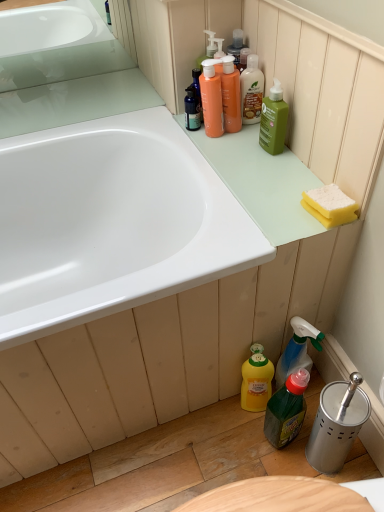
The image size is (384, 512). What do you see at coordinates (251, 91) in the screenshot? I see `translucent plastic bottle at upper center, positioned as the 5th cleaning product in bottom-to-top order` at bounding box center [251, 91].

You are a GUI agent. You are given a task and a screenshot of the screen. Output one action in this format:
    pyautogui.click(x=<x>, y=<y>)
    Task: Click on the translucent plastic bottle at upper center, which appears as the first cleaning product when viewed from the top
    The width and height of the screenshot is (384, 512).
    Given the screenshot: What is the action you would take?
    pyautogui.click(x=251, y=91)

The width and height of the screenshot is (384, 512). What do you see at coordinates (297, 350) in the screenshot? I see `translucent plastic spray bottle at lower right, which is the fourth cleaning product in top-to-bottom order` at bounding box center [297, 350].

What is the approximate width of yellow sponge at upper right?

It is 3.66 inches.

What do you see at coordinates (330, 202) in the screenshot?
I see `yellow sponge at upper right` at bounding box center [330, 202].

This screenshot has width=384, height=512. What do you see at coordinates (273, 120) in the screenshot?
I see `green matte bottle at upper right, which ranks as the third cleaning product in bottom-to-top order` at bounding box center [273, 120].

Where is `yellow matte bottle at lower center, positioned as the 1th cleaning product in bottom-to-top order`? This screenshot has height=512, width=384. yellow matte bottle at lower center, positioned as the 1th cleaning product in bottom-to-top order is located at coordinates (256, 380).

Where is `translucent plastic bottle at upper center, which appears as the first cleaning product when viewed from the top`? translucent plastic bottle at upper center, which appears as the first cleaning product when viewed from the top is located at coordinates (251, 91).

Consider the image. Is matte orange pump bottles at upper center, the fourth cleaning product positioned from the bottom, spatially inside green matte bottle at upper right, which appears as the 3th cleaning product when viewed from the top, or outside of it?

matte orange pump bottles at upper center, the fourth cleaning product positioned from the bottom, is not enclosed by green matte bottle at upper right, which appears as the 3th cleaning product when viewed from the top.

At what (x,y) coordinates should I click in order to perform the action: click on cleaning product that is the 2nd one when counting backward from the green matte bottle at upper right, which appears as the 3th cleaning product when viewed from the top. Please return your answer as a coordinate pair (x, y). The height and width of the screenshot is (512, 384). Looking at the image, I should click on (211, 99).

Is matte orange pump bottles at upper center, which is the second cleaning product from top to bottom, aimed at green matte bottle at upper right, which ranks as the third cleaning product in bottom-to-top order?

No, matte orange pump bottles at upper center, which is the second cleaning product from top to bottom, does not turn towards green matte bottle at upper right, which ranks as the third cleaning product in bottom-to-top order.

Which of these two, translucent green bottle at lower center or yellow sponge at upper right, stands taller?

translucent green bottle at lower center.

Could you tell me if translucent green bottle at lower center is turned towards yellow sponge at upper right?

No.

Can you confirm if translucent green bottle at lower center is thinner than yellow sponge at upper right?

No.

Is translucent green bottle at lower center touching yellow sponge at upper right?

There is a gap between translucent green bottle at lower center and yellow sponge at upper right.

Are translucent plastic spray bottle at lower right, which is the fourth cleaning product in top-to-bottom order, and yellow sponge at upper right far apart?

No, there isn't a large distance between translucent plastic spray bottle at lower right, which is the fourth cleaning product in top-to-bottom order, and yellow sponge at upper right.

From the image's perspective, between translucent plastic spray bottle at lower right, which is the fourth cleaning product in top-to-bottom order, and yellow sponge at upper right, which one is located above?

yellow sponge at upper right, from the image's perspective.

Which point is more distant from viewer, (294, 328) or (337, 207)?

Positioned behind is point (294, 328).

Can you confirm if translucent plastic spray bottle at lower right, which is counted as the 2th cleaning product, starting from the bottom, is smaller than yellow sponge at upper right?

No, translucent plastic spray bottle at lower right, which is counted as the 2th cleaning product, starting from the bottom, is not smaller than yellow sponge at upper right.

How different are the orientations of translucent plastic bottle at upper center, positioned as the 5th cleaning product in bottom-to-top order, and yellow sponge at upper right in degrees?

There is a 2.39-degree angle between the facing directions of translucent plastic bottle at upper center, positioned as the 5th cleaning product in bottom-to-top order, and yellow sponge at upper right.

Can you confirm if translucent plastic bottle at upper center, positioned as the 5th cleaning product in bottom-to-top order, is taller than yellow sponge at upper right?

Yes.

Which is more to the left, translucent plastic bottle at upper center, positioned as the 5th cleaning product in bottom-to-top order, or yellow sponge at upper right?

translucent plastic bottle at upper center, positioned as the 5th cleaning product in bottom-to-top order, is more to the left.

Is translucent plastic bottle at upper center, positioned as the 5th cleaning product in bottom-to-top order, positioned with its back to yellow sponge at upper right?

No.

This screenshot has height=512, width=384. In order to click on cleaning product that is the 3rd object located in front of the translucent plastic bottle at upper center, positioned as the 5th cleaning product in bottom-to-top order in this screenshot , I will do tap(273, 120).

Based on the photo, between translucent plastic bottle at upper center, which appears as the first cleaning product when viewed from the top, and green matte bottle at upper right, which appears as the 3th cleaning product when viewed from the top, which one is positioned behind?

translucent plastic bottle at upper center, which appears as the first cleaning product when viewed from the top, is further away from the camera.

Between translucent plastic bottle at upper center, positioned as the 5th cleaning product in bottom-to-top order, and green matte bottle at upper right, which ranks as the third cleaning product in bottom-to-top order, which one has less height?

Standing shorter between the two is green matte bottle at upper right, which ranks as the third cleaning product in bottom-to-top order.

Considering the positions of points (247, 103) and (282, 111), is point (247, 103) farther from camera compared to point (282, 111)?

That is True.

Locate an element on the screen. The height and width of the screenshot is (512, 384). cleaning product in front of the green matte bottle at upper right, which ranks as the third cleaning product in bottom-to-top order is located at coordinates point(297,350).

Do you think translucent plastic spray bottle at lower right, which is counted as the 2th cleaning product, starting from the bottom, is within green matte bottle at upper right, which ranks as the third cleaning product in bottom-to-top order, or outside of it?

translucent plastic spray bottle at lower right, which is counted as the 2th cleaning product, starting from the bottom, lies outside green matte bottle at upper right, which ranks as the third cleaning product in bottom-to-top order.

Based on their positions, is translucent plastic spray bottle at lower right, which is counted as the 2th cleaning product, starting from the bottom, located to the left or right of green matte bottle at upper right, which ranks as the third cleaning product in bottom-to-top order?

Based on their positions, translucent plastic spray bottle at lower right, which is counted as the 2th cleaning product, starting from the bottom, is located to the right of green matte bottle at upper right, which ranks as the third cleaning product in bottom-to-top order.

Is point (284, 380) closer or farther from the camera than point (263, 109)?

Point (284, 380).

Which is more to the right, translucent plastic spray bottle at lower right, which is counted as the 2th cleaning product, starting from the bottom, or matte orange pump bottles at upper center, the fourth cleaning product positioned from the bottom?

translucent plastic spray bottle at lower right, which is counted as the 2th cleaning product, starting from the bottom.

Is translucent plastic spray bottle at lower right, which is counted as the 2th cleaning product, starting from the bottom, located outside matte orange pump bottles at upper center, the fourth cleaning product positioned from the bottom?

Yes, translucent plastic spray bottle at lower right, which is counted as the 2th cleaning product, starting from the bottom, is located beyond the bounds of matte orange pump bottles at upper center, the fourth cleaning product positioned from the bottom.

Starting from the translucent plastic spray bottle at lower right, which is counted as the 2th cleaning product, starting from the bottom, which cleaning product is the 3rd one behind? Please provide its 2D coordinates.

[(211, 99)]

Considering the sizes of objects translucent plastic spray bottle at lower right, which is the fourth cleaning product in top-to-bottom order, and matte orange pump bottles at upper center, the fourth cleaning product positioned from the bottom, in the image provided, who is thinner, translucent plastic spray bottle at lower right, which is the fourth cleaning product in top-to-bottom order, or matte orange pump bottles at upper center, the fourth cleaning product positioned from the bottom,?

Thinner between the two is matte orange pump bottles at upper center, the fourth cleaning product positioned from the bottom.

Where is `cleaning product that is the 2nd object located in front of the matte orange pump bottles at upper center, the fourth cleaning product positioned from the bottom`? cleaning product that is the 2nd object located in front of the matte orange pump bottles at upper center, the fourth cleaning product positioned from the bottom is located at coordinates (273, 120).

Locate an element on the screen. This screenshot has width=384, height=512. bottle on the left of yellow sponge at upper right is located at coordinates (286, 410).

Based on their spatial positions, is green matte bottle at upper right, which ranks as the third cleaning product in bottom-to-top order, or translucent plastic spray bottle at lower right, which is the fourth cleaning product in top-to-bottom order, closer to yellow sponge at upper right?

Based on the image, green matte bottle at upper right, which ranks as the third cleaning product in bottom-to-top order, appears to be nearer to yellow sponge at upper right.

Looking at the image, which one is located further to green matte bottle at upper right, which appears as the 3th cleaning product when viewed from the top, translucent green bottle at lower center or yellow sponge at upper right?

translucent green bottle at lower center.

Based on their spatial positions, is translucent plastic bottle at upper center, which appears as the first cleaning product when viewed from the top, or yellow sponge at upper right closer to translucent plastic spray bottle at lower right, which is counted as the 2th cleaning product, starting from the bottom?

Based on the image, yellow sponge at upper right appears to be nearer to translucent plastic spray bottle at lower right, which is counted as the 2th cleaning product, starting from the bottom.

Based on the photo, considering their positions, is translucent plastic mouthwash at upper center positioned further to translucent plastic bottle at upper center, positioned as the 5th cleaning product in bottom-to-top order, than green matte bottle at upper right, which ranks as the third cleaning product in bottom-to-top order?

green matte bottle at upper right, which ranks as the third cleaning product in bottom-to-top order.

Estimate the real-world distances between objects in this image. Which object is closer to translucent plastic spray bottle at lower right, which is counted as the 2th cleaning product, starting from the bottom, matte orange pump bottles at upper center, the fourth cleaning product positioned from the bottom, or translucent plastic mouthwash at upper center?

matte orange pump bottles at upper center, the fourth cleaning product positioned from the bottom, is closer to translucent plastic spray bottle at lower right, which is counted as the 2th cleaning product, starting from the bottom.

Considering their positions, is translucent plastic bottle at upper center, which appears as the first cleaning product when viewed from the top, positioned closer to yellow sponge at upper right than translucent green bottle at lower center?

translucent plastic bottle at upper center, which appears as the first cleaning product when viewed from the top, is closer to yellow sponge at upper right.

When comparing their distances from translucent plastic spray bottle at lower right, which is the fourth cleaning product in top-to-bottom order, does translucent plastic bottle at upper center, which appears as the first cleaning product when viewed from the top, or matte orange pump bottles at upper center, the fourth cleaning product positioned from the bottom, seem further?

translucent plastic bottle at upper center, which appears as the first cleaning product when viewed from the top.

When comparing their distances from yellow matte bottle at lower center, positioned as the 1th cleaning product in bottom-to-top order, does green matte bottle at upper right, which appears as the 3th cleaning product when viewed from the top, or translucent green bottle at lower center seem further?

Among the two, green matte bottle at upper right, which appears as the 3th cleaning product when viewed from the top, is located further to yellow matte bottle at lower center, positioned as the 1th cleaning product in bottom-to-top order.

Locate an element on the screen. The image size is (384, 512). mouthwash between translucent plastic bottle at upper center, which appears as the first cleaning product when viewed from the top, and translucent plastic spray bottle at lower right, which is counted as the 2th cleaning product, starting from the bottom, from top to bottom is located at coordinates (231, 95).

Locate an element on the screen. The image size is (384, 512). cleaning product between green matte bottle at upper right, which appears as the 3th cleaning product when viewed from the top, and yellow matte bottle at lower center, the fifth cleaning product in the top-to-bottom sequence, vertically is located at coordinates (297, 350).

Identify the location of soap that lies between green matte bottle at upper right, which appears as the 3th cleaning product when viewed from the top, and yellow matte bottle at lower center, the fifth cleaning product in the top-to-bottom sequence, from top to bottom. (330, 202).

At what (x,y) coordinates should I click in order to perform the action: click on soap between translucent plastic bottle at upper center, positioned as the 5th cleaning product in bottom-to-top order, and translucent green bottle at lower center in the up-down direction. Please return your answer as a coordinate pair (x, y). This screenshot has width=384, height=512. Looking at the image, I should click on (330, 202).